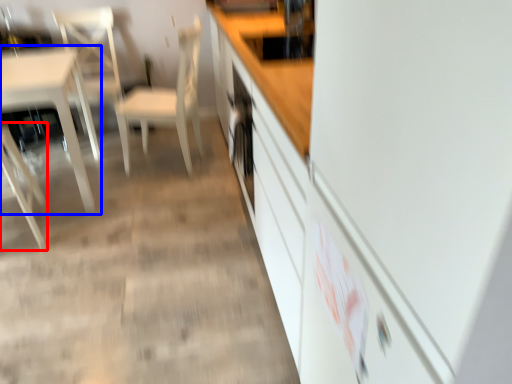
Question: Which object is further to the camera taking this photo, chair (highlighted by a red box) or table (highlighted by a blue box)?

Choices:
 (A) chair
 (B) table

Answer: (B)